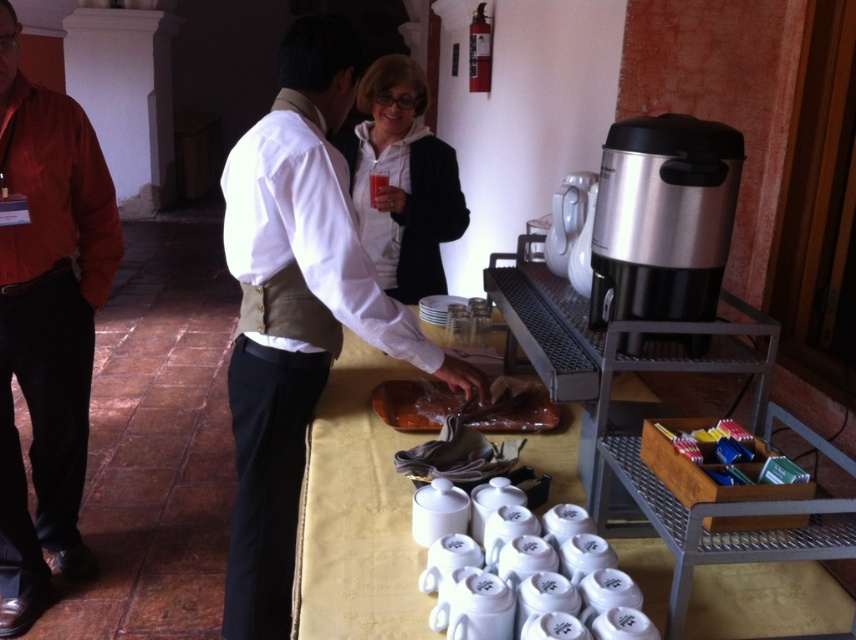
Question: Does white matte jacket at center have a larger size compared to brown leather bag at center?

Choices:
 (A) no
 (B) yes

Answer: (B)

Question: Which object is closer to the camera taking this photo?

Choices:
 (A) matte orange shirt at left
 (B) silver metallic coffee machine at right
 (C) metallic silver coffee pot at right
 (D) brown leather bag at center

Answer: (B)

Question: Is white matte jacket at center above brown leather bag at center?

Choices:
 (A) no
 (B) yes

Answer: (B)

Question: Which point appears closest to the camera in this image?

Choices:
 (A) (633, 132)
 (B) (435, 400)
 (C) (375, 170)

Answer: (A)

Question: Is matte orange shirt at left to the left of clear plastic cup at center from the viewer's perspective?

Choices:
 (A) no
 (B) yes

Answer: (B)

Question: Which of these objects is positioned closest to the matte orange shirt at left?

Choices:
 (A) clear plastic cup at center
 (B) metallic silver coffee pot at right
 (C) brown leather bag at center
 (D) white matte jacket at center

Answer: (D)